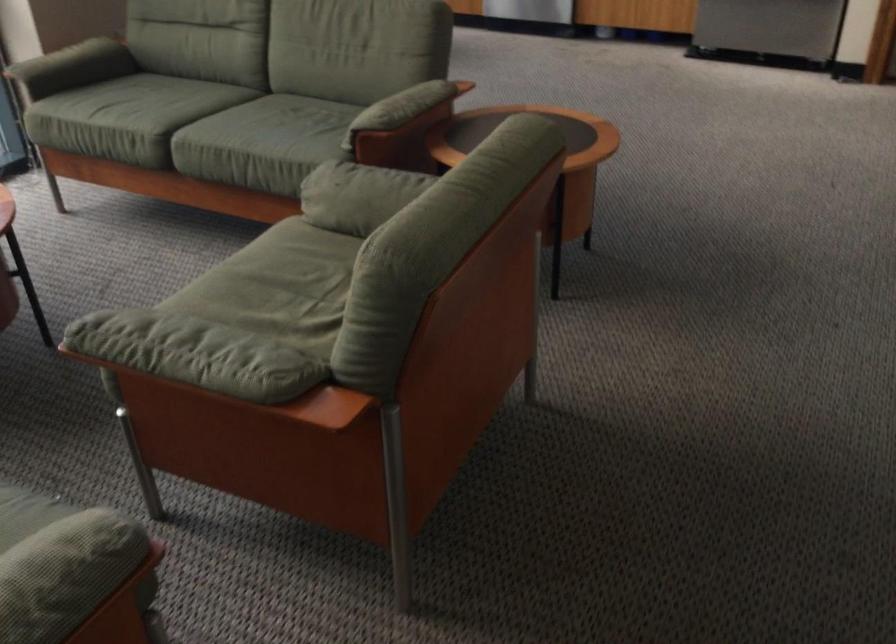
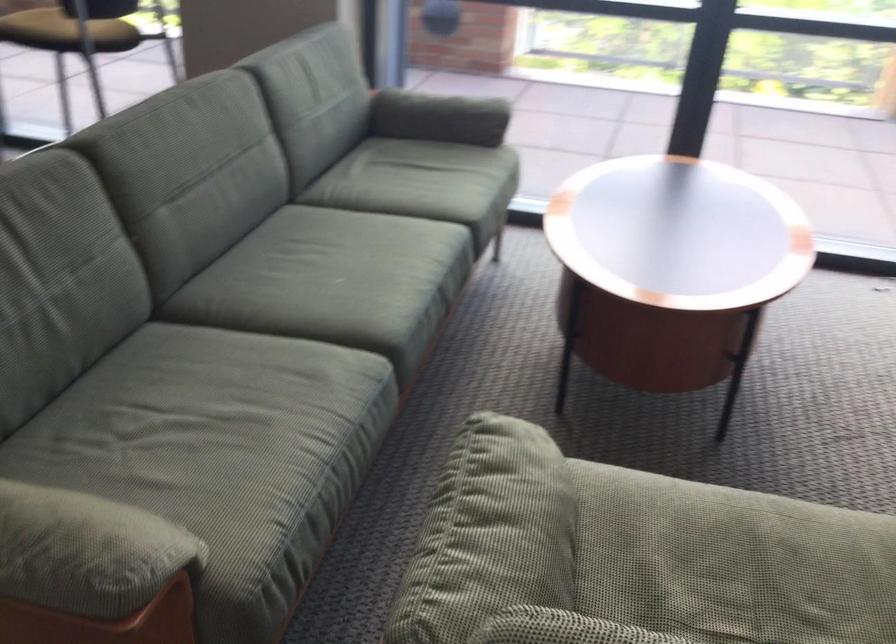
In the second image, find the point that corresponds to the point at 205,330 in the first image.

(500, 527)